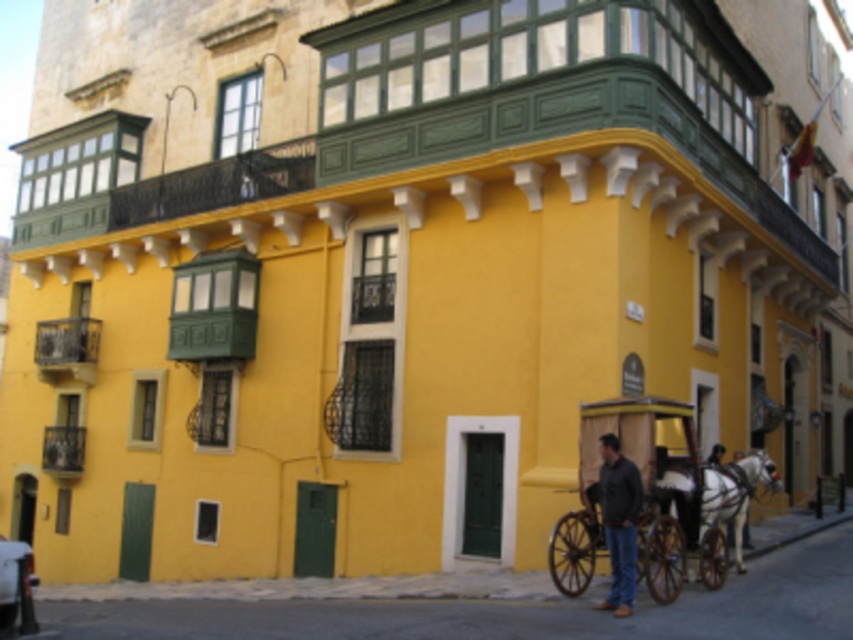
Question: Which point is farther to the camera?

Choices:
 (A) white glossy horse at lower right
 (B) matte brown wooden coach at lower right
 (C) metallic silver car at lower left
 (D) wooden cart at lower right

Answer: (A)

Question: Among these objects, which one is nearest to the camera?

Choices:
 (A) matte brown wooden coach at lower right
 (B) white glossy horse at lower right
 (C) wooden cart at lower right
 (D) metallic silver car at lower left

Answer: (D)

Question: Does white glossy horse at lower right have a greater width compared to metallic silver car at lower left?

Choices:
 (A) no
 (B) yes

Answer: (A)

Question: From the image, what is the correct spatial relationship of wooden cart at lower right in relation to white glossy horse at lower right?

Choices:
 (A) above
 (B) below

Answer: (A)

Question: Which point is closer to the camera?

Choices:
 (A) white glossy horse at lower right
 (B) wooden cart at lower right
 (C) matte brown wooden coach at lower right
 (D) metallic silver car at lower left

Answer: (D)

Question: Where is matte brown wooden coach at lower right located in relation to white glossy horse at lower right in the image?

Choices:
 (A) below
 (B) above

Answer: (B)